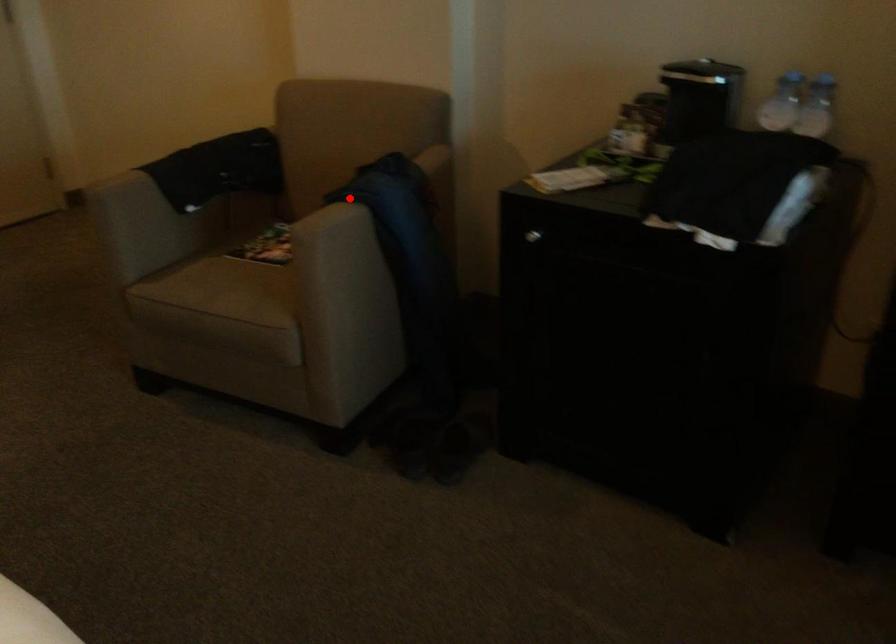
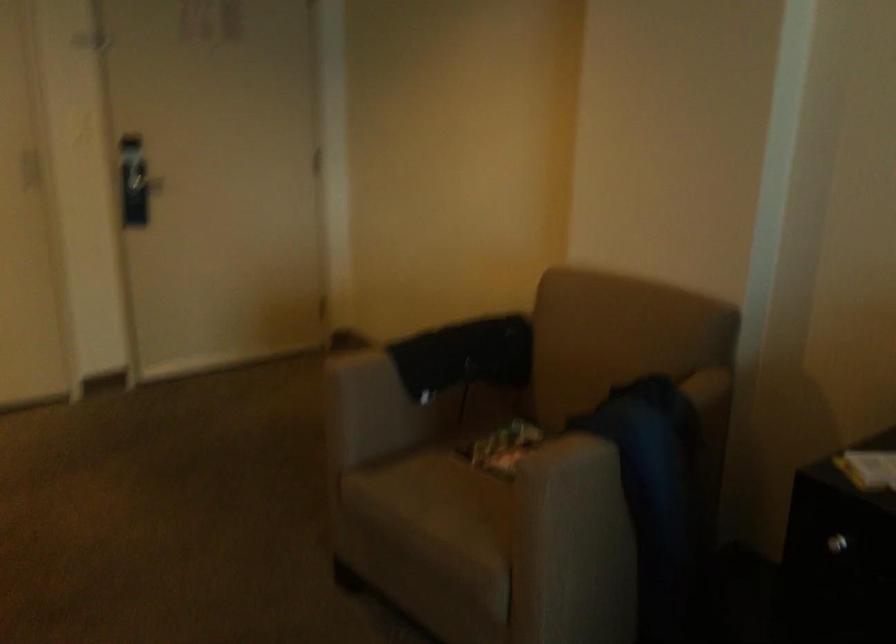
Question: I am providing you with two images of the same scene from different viewpoints. Given a red point in image1, look at the same physical point in image2. Is it:

Choices:
 (A) Closer to the viewpoint
 (B) Farther from the viewpoint

Answer: (A)